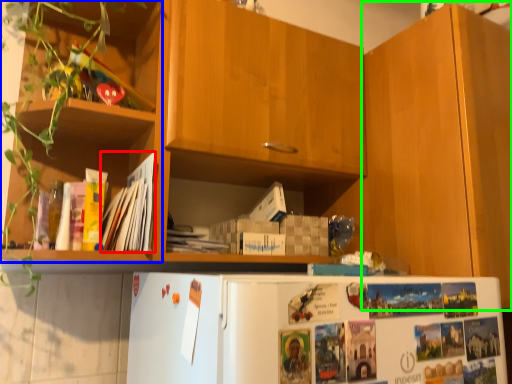
Question: Considering the real-world distances, which object is farthest from magazine (highlighted by a red box)? shelf (highlighted by a blue box) or cabinetry (highlighted by a green box)?

Choices:
 (A) shelf
 (B) cabinetry

Answer: (B)